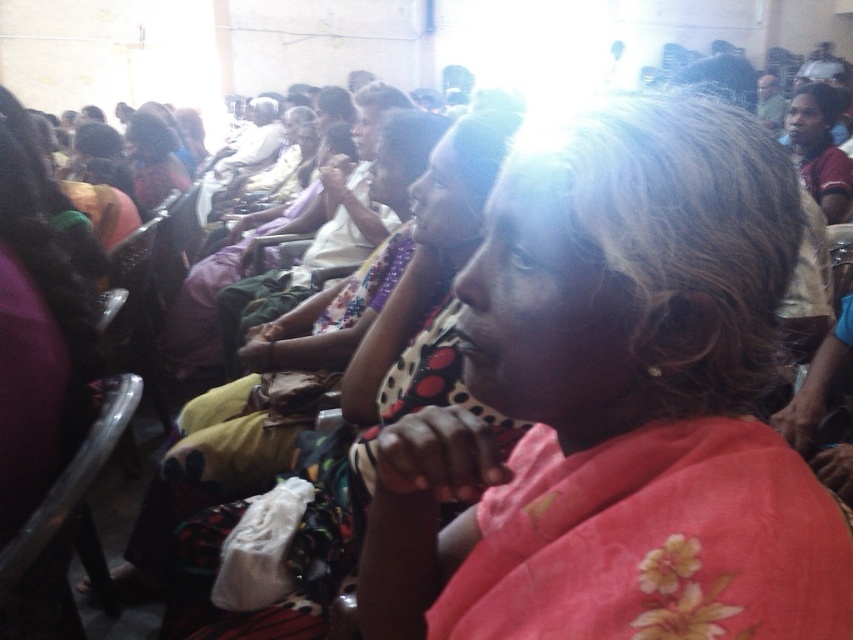
You are standing at the entrance of the community hall and see the point at coordinates [614,403]. What object is located at that point?

The point at coordinates [614,403] corresponds to the floral pink scarf at center.

You are planning to take a photo of the two items in the scene, the floral pink scarf at center and the polka dot fabric dress at center. Since you want both to be clearly visible in the photo, which item should you focus on to ensure the smaller one is in sharp focus?

The floral pink scarf at center is smaller than the polka dot fabric dress at center, so you should focus on the floral pink scarf at center to ensure it is in sharp focus.